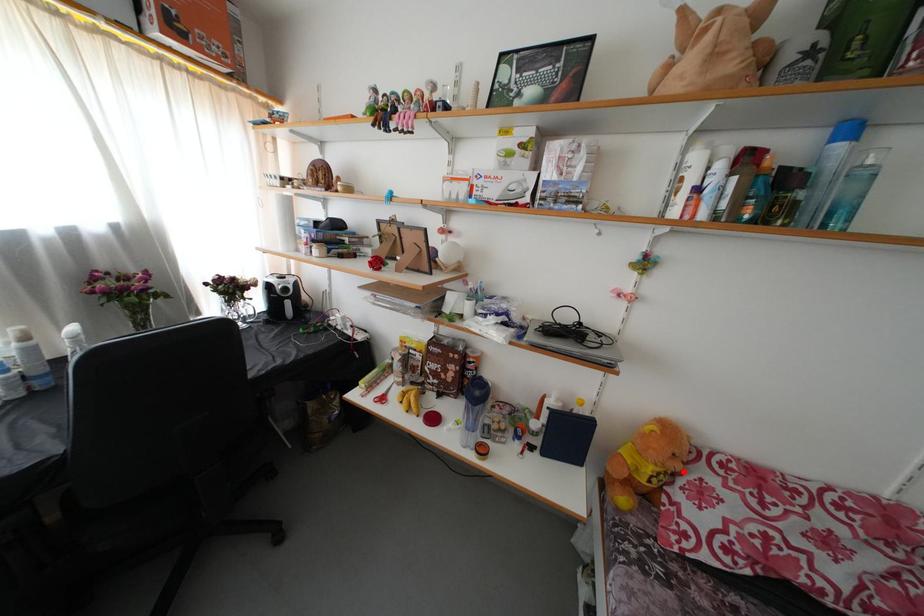
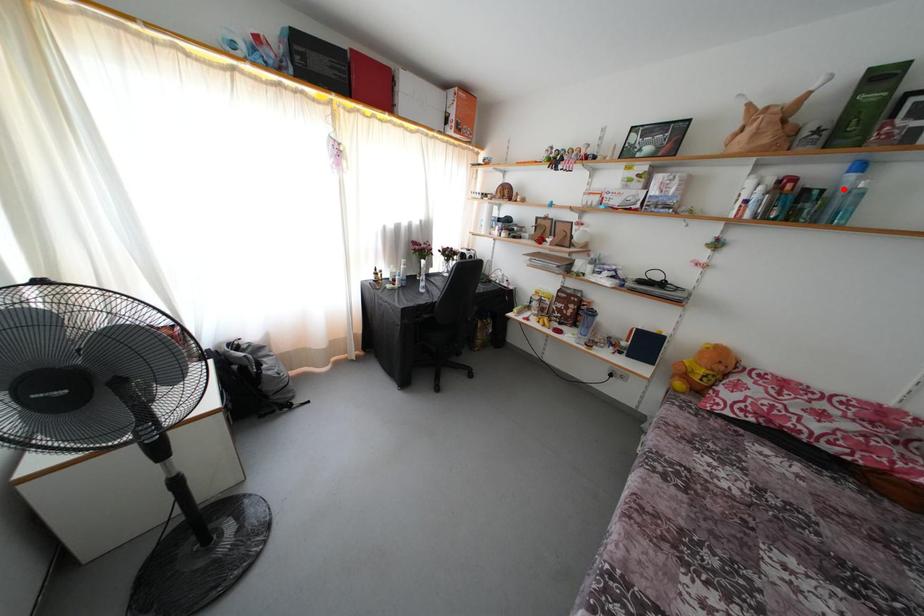
I am providing you with two images of the same scene from different viewpoints. A red point is marked on the first image and another point is marked on the second image. Do the highlighted points in image1 and image2 indicate the same real-world spot?

No